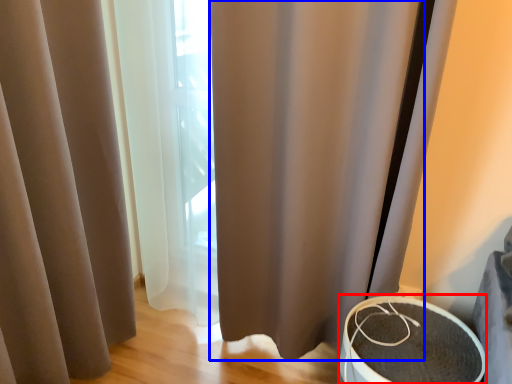
Question: Which of the following is the farthest to the observer, round table (highlighted by a red box) or shower curtain (highlighted by a blue box)?

Choices:
 (A) round table
 (B) shower curtain

Answer: (A)